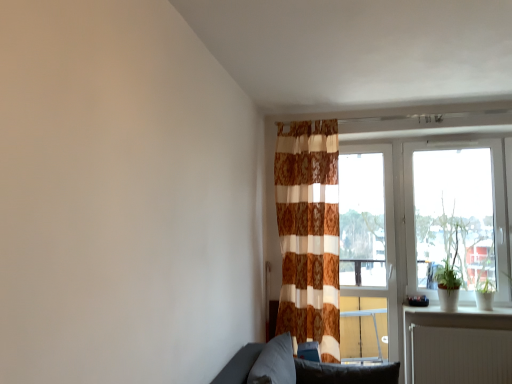
Question: Which is correct: brown textured curtain at center is inside green matte plant at right, or outside of it?

Choices:
 (A) inside
 (B) outside

Answer: (B)

Question: Based on their sizes in the image, would you say brown textured curtain at center is bigger or smaller than green matte plant at right?

Choices:
 (A) big
 (B) small

Answer: (A)

Question: Which object is positioned farthest from the brown textured curtain at center?

Choices:
 (A) white ribbed radiator at lower right
 (B) white glossy window sill at lower right
 (C) dark gray fabric pillow at lower center, the first pillow positioned from the left
 (D) transparent glass window at right
 (E) green matte plant at right

Answer: (E)

Question: Which object is the farthest from the transparent glass window at right?

Choices:
 (A) green matte plant at right
 (B) soft gray cushion at lower center, which ranks as the second pillow in left-to-right order
 (C) white glossy window sill at lower right
 (D) white ribbed radiator at lower right
 (E) dark gray fabric pillow at lower center, the first pillow positioned from the left

Answer: (E)